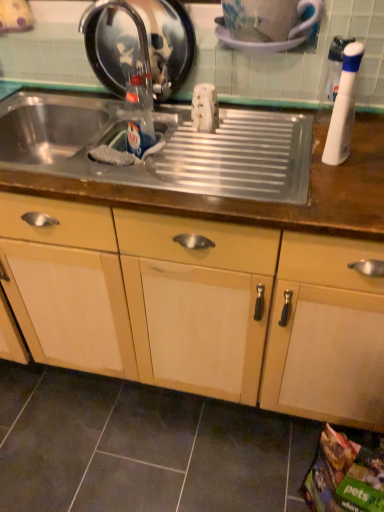
Locate an element on the screen. free space to the back side of white plastic bottle at right, which appears as the 2th bottle when viewed from the back is located at coordinates (309, 133).